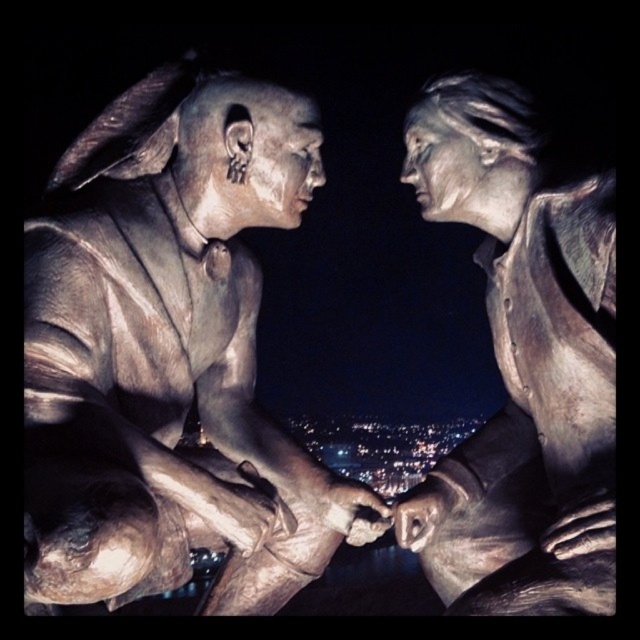
In the scene shown: You are a tour guide leading a group through an art gallery. You want to ensure visitors can comfortably walk between the bronze statue at left and the bronze statue at center without feeling cramped. The average width of a person is 0.5 meters. Is the space between them sufficient for a single person to pass through comfortably?

The distance between the bronze statue at left and the bronze statue at center is 5.09 meters, which is more than enough space for a single person of 0.5 meters width to pass through comfortably.

You are a photographer trying to capture a clear photo of both the bronze statue at left and bronze statue at center. However, you notice that one of the statues is blocking the view of the other. Which bronze statue is blocking the other one?

The bronze statue at left is positioned under bronze statue at center, so the bronze statue at center is blocking the view of the bronze statue at left.

You are an art conservator assessing the spacing between two bronze statues in a gallery. The statues are the bronze statue at left and bronze statue at center. Given that the gallery requires at least 1 meter of space between any two statues for maintenance access, can you determine if the current spacing between them meets this requirement based on their widths?

The bronze statue at left is wider than the bronze statue at center. However, the provided information only states their relative widths and does not specify the actual distance between them. Therefore, it is impossible to determine if the spacing meets the 1 meter requirement without additional measurements.